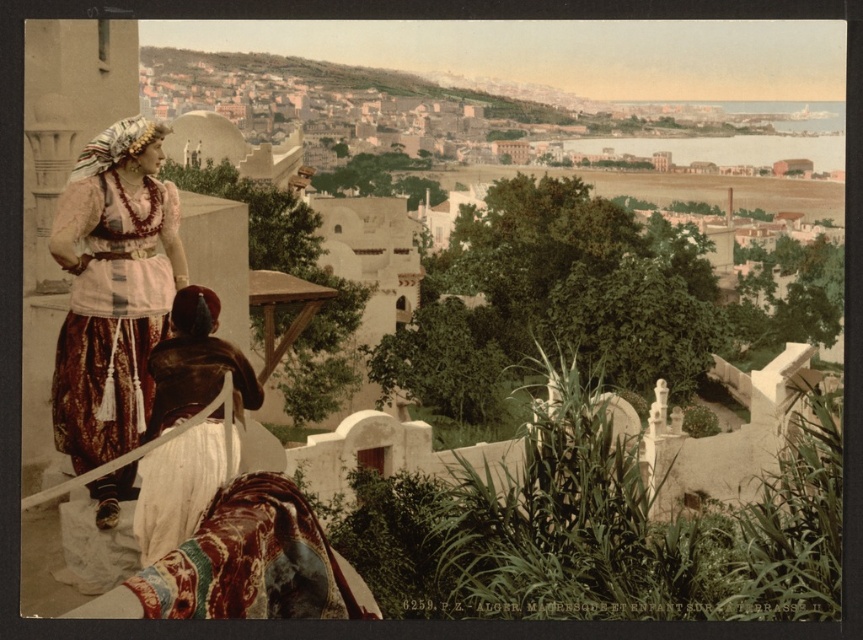
Question: Which of the following is the farthest from the observer?

Choices:
 (A) matte brown dress at left
 (B) brown leather dress at center

Answer: (B)

Question: Where is matte brown dress at left located in relation to brown leather dress at center in the image?

Choices:
 (A) above
 (B) below

Answer: (A)

Question: Is matte brown dress at left thinner than brown leather dress at center?

Choices:
 (A) yes
 (B) no

Answer: (B)

Question: Does matte brown dress at left appear on the right side of brown leather dress at center?

Choices:
 (A) no
 (B) yes

Answer: (A)